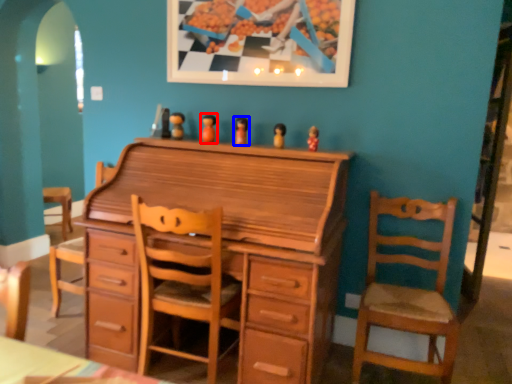
Question: Which point is further to the camera, toy (highlighted by a red box) or toy (highlighted by a blue box)?

Choices:
 (A) toy
 (B) toy

Answer: (A)